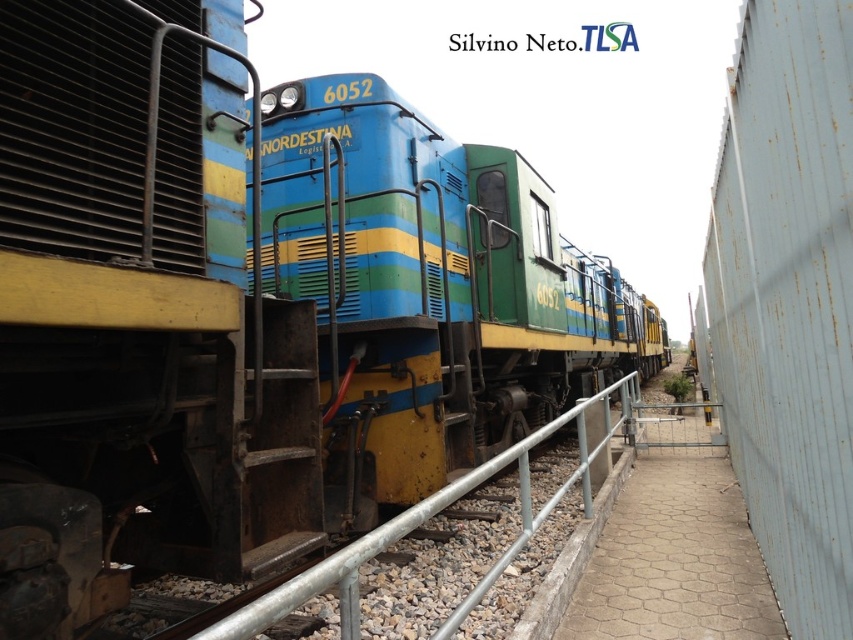
You are a railway inspector checking the station. You need to compare the width of the rusty metal fence at right and the metallic gray rail at center. Which one is wider?

The metallic gray rail at center is wider than the rusty metal fence at right.